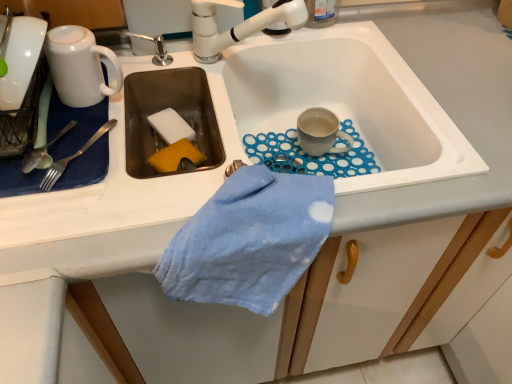
Identify the location of vacant area that lies to the right of satin silver fork at left, the first silverware from the right. (158, 173).